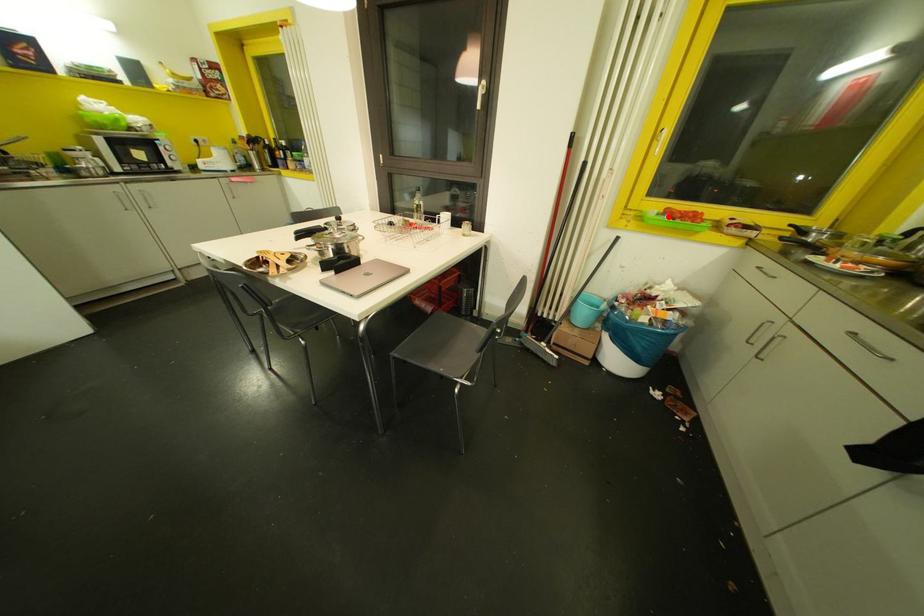
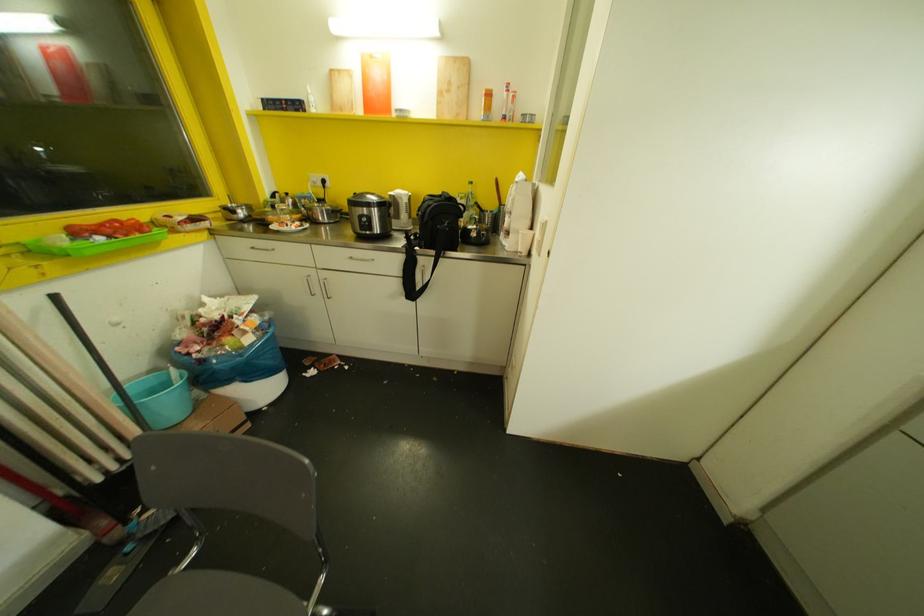
Locate, in the second image, the point that corresponds to the highlighted location in the first image.

(99, 237)